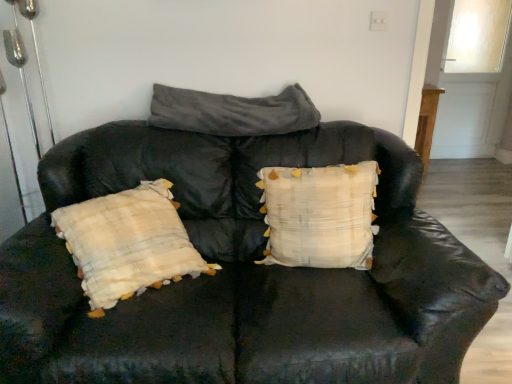
Question: Would you say white textured pillow at center, the 2th pillow viewed from the top, is to the left or to the right of gray fuzzy blanket at upper center, the 1th pillow when ordered from top to bottom, in the picture?

Choices:
 (A) left
 (B) right

Answer: (B)

Question: Is white textured pillow at center, which is the first pillow in bottom-to-top order, spatially inside gray fuzzy blanket at upper center, positioned as the second pillow in bottom-to-top order, or outside of it?

Choices:
 (A) outside
 (B) inside

Answer: (A)

Question: Relative to gray fuzzy blanket at upper center, positioned as the second pillow in bottom-to-top order, is white textured pillow at center, which is the first pillow in bottom-to-top order, in front or behind?

Choices:
 (A) front
 (B) behind

Answer: (A)

Question: Is gray fuzzy blanket at upper center, positioned as the second pillow in bottom-to-top order, wider or thinner than white textured pillow at center, which is the first pillow in bottom-to-top order?

Choices:
 (A) thin
 (B) wide

Answer: (B)

Question: From the image's perspective, is gray fuzzy blanket at upper center, the 1th pillow when ordered from top to bottom, positioned above or below white textured pillow at center, the 2th pillow viewed from the top?

Choices:
 (A) below
 (B) above

Answer: (B)

Question: Considering the positions of gray fuzzy blanket at upper center, the 1th pillow when ordered from top to bottom, and white textured pillow at center, which is the first pillow in bottom-to-top order, in the image, is gray fuzzy blanket at upper center, the 1th pillow when ordered from top to bottom, bigger or smaller than white textured pillow at center, which is the first pillow in bottom-to-top order,?

Choices:
 (A) big
 (B) small

Answer: (B)

Question: Considering the positions of point 218,104 and point 279,178, is point 218,104 closer or farther from the camera than point 279,178?

Choices:
 (A) farther
 (B) closer

Answer: (A)